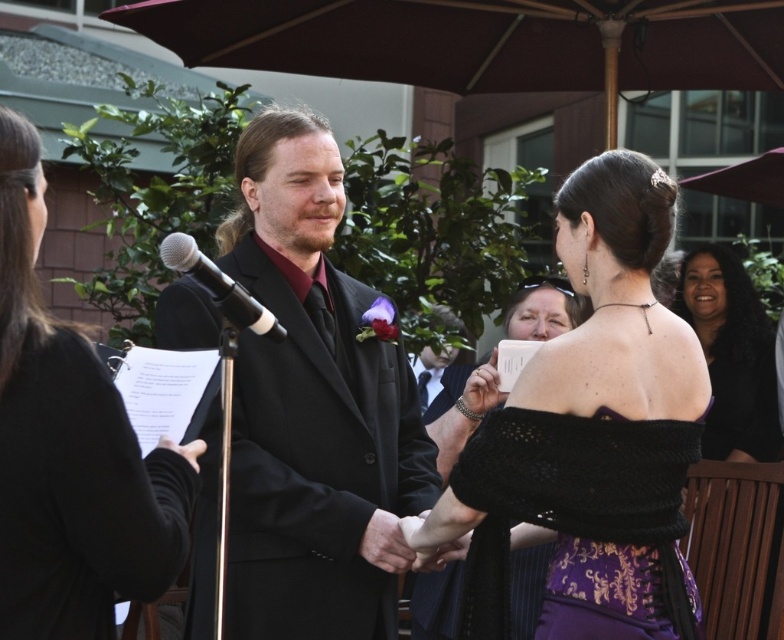
You are a photographer at the wedding ceremony and you need to capture a photo of both the purple knitted dress at center and the black lace dress at center. Which dress should you focus on first if you want to include both in the frame?

The purple knitted dress at center is positioned on the left side of black lace dress at center, so you should focus on the purple knitted dress at center first to ensure both dresses are included in the frame.